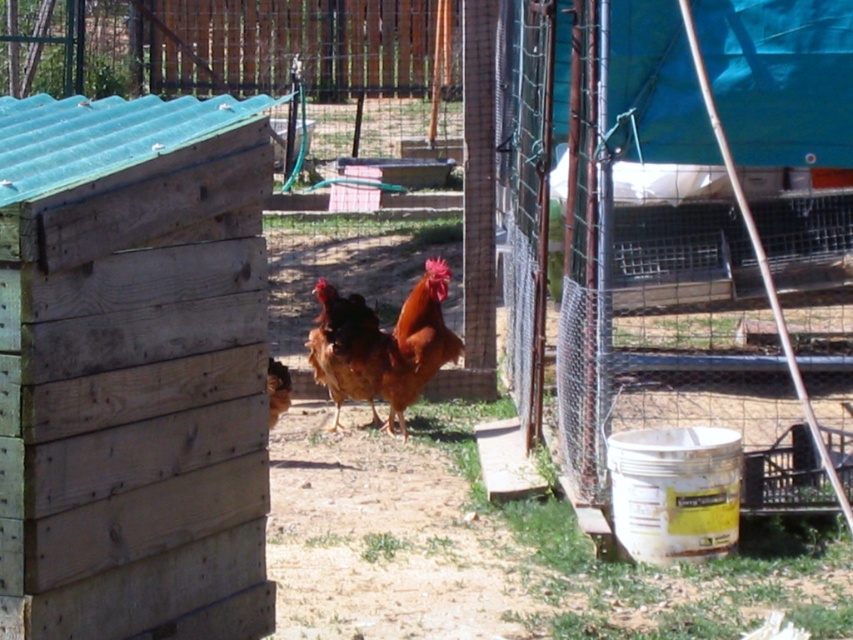
You are standing in the backyard and see the brown feathered rooster at center. If you want to toss a small treat to the rooster, and your throwing range is 8 meters, will you be able to reach it?

The brown feathered rooster at center is 9.16 meters away from the viewer. Since your throwing range is 8 meters, you cannot reach the rooster with the treat.

You are a farmer checking the health of your poultry. You notice that the brown matte chicken at center and the brown feathered rooster at center are both standing on the dirt patch. Which one is taller?

The brown matte chicken at center is much taller than the brown feathered rooster at center.